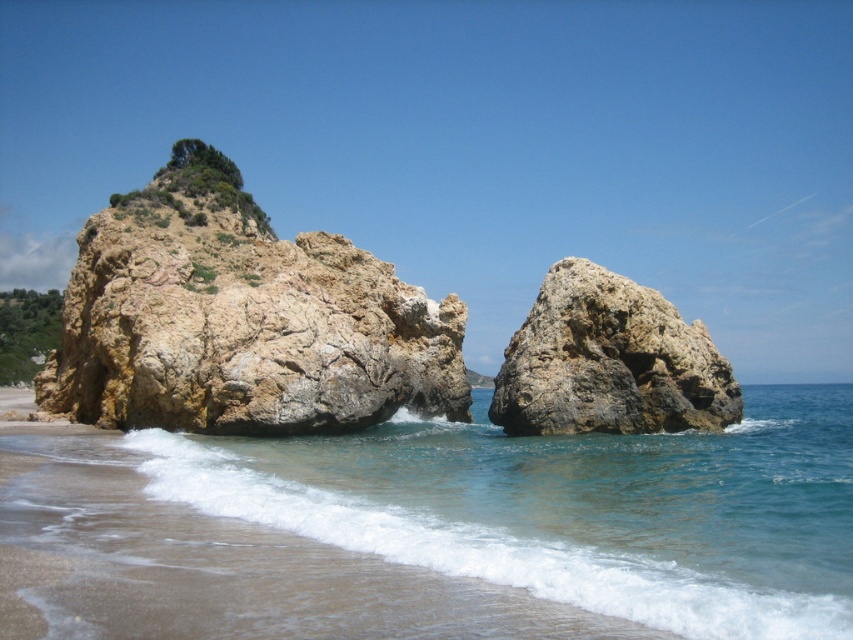
Question: Which of the following is the farthest from the observer?

Choices:
 (A) rusty brown rock at center
 (B) clear blue water at lower left
 (C) rustic stone rock at left

Answer: (A)

Question: Based on their relative distances, which object is nearer to the rustic stone rock at left?

Choices:
 (A) clear blue water at lower left
 (B) rusty brown rock at center

Answer: (A)

Question: Does clear blue water at lower left have a greater width compared to rusty brown rock at center?

Choices:
 (A) yes
 (B) no

Answer: (A)

Question: Does clear blue water at lower left lie in front of rustic stone rock at left?

Choices:
 (A) no
 (B) yes

Answer: (B)

Question: Estimate the real-world distances between objects in this image. Which object is closer to the rustic stone rock at left?

Choices:
 (A) clear blue water at lower left
 (B) rusty brown rock at center

Answer: (A)

Question: Considering the relative positions of clear blue water at lower left and rusty brown rock at center in the image provided, where is clear blue water at lower left located with respect to rusty brown rock at center?

Choices:
 (A) below
 (B) above

Answer: (A)